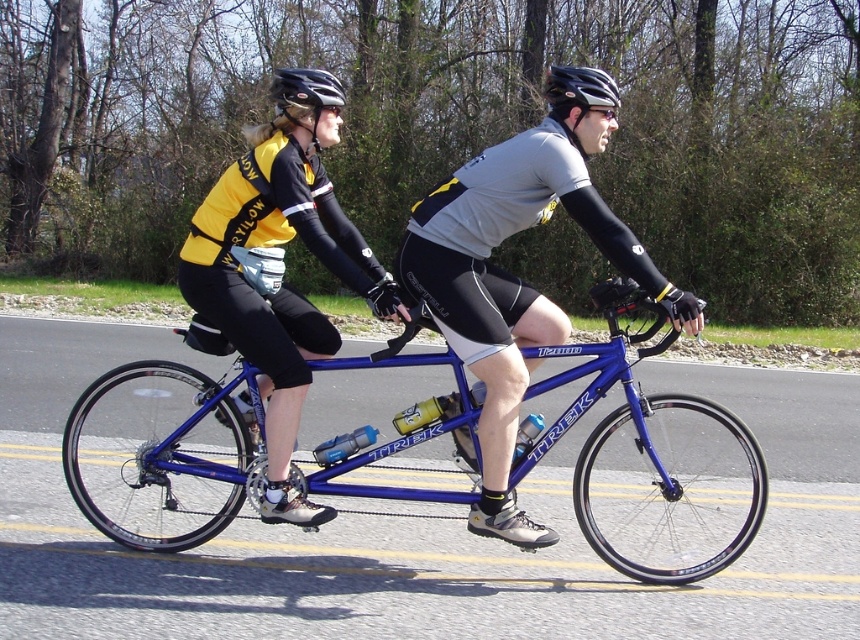
You are a photographer standing next to the road where the matte blue bicycle at center and the black matte helmet at center are located. You want to take a photo that includes both objects in the frame. Which object should you position closer to the bottom of the photo to ensure both are fully visible?

The matte blue bicycle at center is not as tall as the black matte helmet at center, so you should position the taller black matte helmet at center closer to the bottom of the photo to ensure both are fully visible.

You are a delivery person who needs to carry a large package that is 1.5 meters wide. You see the blue metallic bicycle at center and the black matte helmet at center. Which object can you use to carry the package, considering their widths?

The blue metallic bicycle at center has a lesser width compared to black matte helmet at center, so the black matte helmet at center is wider and can be used to carry the large package.